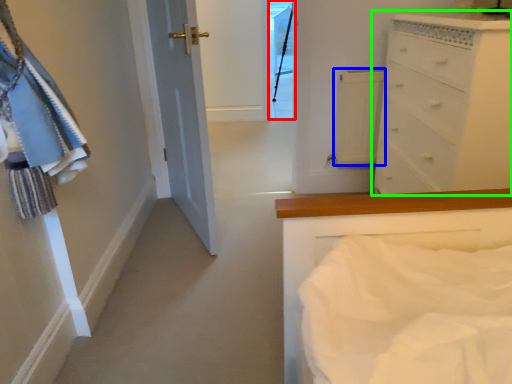
Question: Considering the real-world distances, which object is closest to glass door (highlighted by a red box)? cabinetry (highlighted by a blue box) or chest of drawers (highlighted by a green box).

Choices:
 (A) cabinetry
 (B) chest of drawers

Answer: (A)